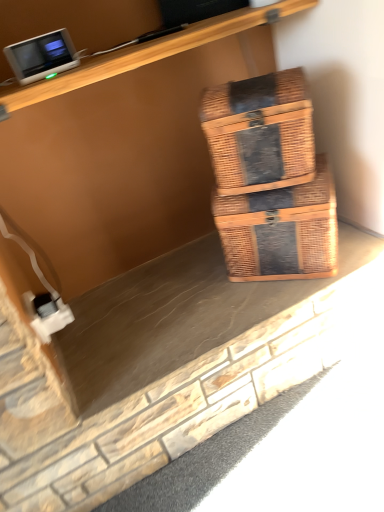
Question: Does white plastic electric outlet at lower left come in front of woven brown box at center, which ranks as the 1th box in bottom-to-top order?

Choices:
 (A) yes
 (B) no

Answer: (B)

Question: From the image's perspective, is white plastic electric outlet at lower left above woven brown box at center, which is counted as the 2th box, starting from the top?

Choices:
 (A) yes
 (B) no

Answer: (B)

Question: Is woven brown box at center, which ranks as the 1th box in bottom-to-top order, at the back of white plastic electric outlet at lower left?

Choices:
 (A) yes
 (B) no

Answer: (B)

Question: Would you say white plastic electric outlet at lower left is outside woven brown box at center, which ranks as the 1th box in bottom-to-top order?

Choices:
 (A) no
 (B) yes

Answer: (B)

Question: Considering the relative sizes of white plastic electric outlet at lower left and woven brown box at center, which is counted as the 2th box, starting from the top, in the image provided, is white plastic electric outlet at lower left taller than woven brown box at center, which is counted as the 2th box, starting from the top,?

Choices:
 (A) yes
 (B) no

Answer: (B)

Question: From a real-world perspective, is white plastic electric outlet at lower left positioned above or below woven brown box at center, arranged as the 2th box when ordered from the bottom?

Choices:
 (A) above
 (B) below

Answer: (B)

Question: In terms of size, does white plastic electric outlet at lower left appear bigger or smaller than woven brown box at center, which appears as the first box when viewed from the top?

Choices:
 (A) big
 (B) small

Answer: (B)

Question: From the image's perspective, relative to woven brown box at center, arranged as the 2th box when ordered from the bottom, is white plastic electric outlet at lower left above or below?

Choices:
 (A) above
 (B) below

Answer: (B)

Question: In terms of height, does white plastic electric outlet at lower left look taller or shorter compared to woven brown box at center, arranged as the 2th box when ordered from the bottom?

Choices:
 (A) tall
 (B) short

Answer: (B)

Question: From the image's perspective, relative to woven brown box at center, arranged as the 2th box when ordered from the bottom, is woven brown box at center, which is counted as the 2th box, starting from the top, above or below?

Choices:
 (A) below
 (B) above

Answer: (A)

Question: Relative to woven brown box at center, arranged as the 2th box when ordered from the bottom, is woven brown box at center, which is counted as the 2th box, starting from the top, in front or behind?

Choices:
 (A) behind
 (B) front

Answer: (A)

Question: Does point (258, 266) appear closer or farther from the camera than point (221, 132)?

Choices:
 (A) farther
 (B) closer

Answer: (A)

Question: Looking at their shapes, would you say woven brown box at center, which is counted as the 2th box, starting from the top, is wider or thinner than woven brown box at center, which appears as the first box when viewed from the top?

Choices:
 (A) wide
 (B) thin

Answer: (A)

Question: From the image's perspective, is woven brown box at center, which ranks as the 1th box in bottom-to-top order, positioned above or below matte gray monitor at upper left?

Choices:
 (A) above
 (B) below

Answer: (B)

Question: Is point (312, 238) closer or farther from the camera than point (18, 59)?

Choices:
 (A) farther
 (B) closer

Answer: (A)